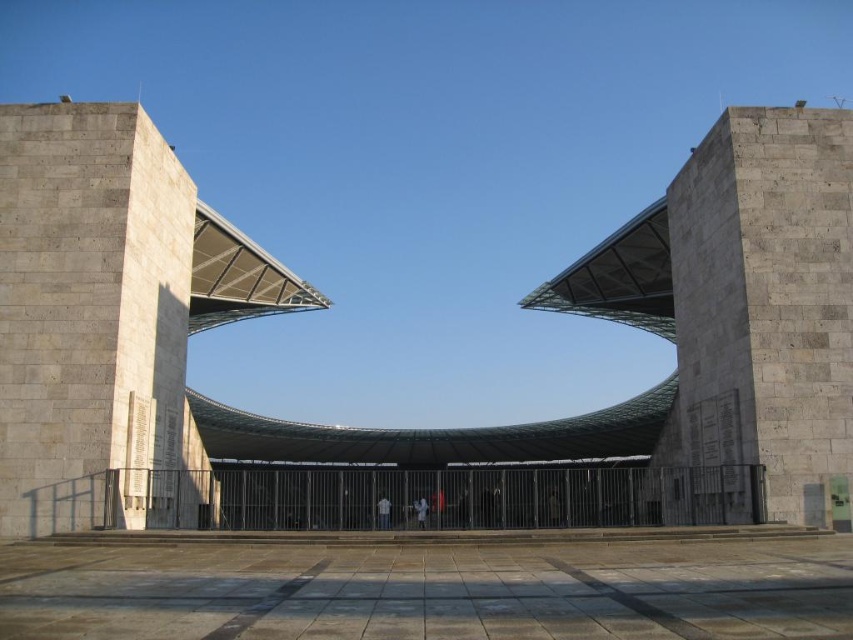
Question: Is gray stone arch at center wider than gray stone pillar at right?

Choices:
 (A) yes
 (B) no

Answer: (A)

Question: Which point appears closest to the camera in this image?

Choices:
 (A) (766, 212)
 (B) (30, 380)

Answer: (B)

Question: Does gray stone arch at center appear on the left side of gray stone pillar at right?

Choices:
 (A) yes
 (B) no

Answer: (A)

Question: Does gray stone arch at center appear on the left side of gray stone pillar at right?

Choices:
 (A) yes
 (B) no

Answer: (A)

Question: Which point is farther to the camera?

Choices:
 (A) (722, 209)
 (B) (131, 358)

Answer: (A)

Question: Which of the following is the closest to the observer?

Choices:
 (A) gray stone pillar at right
 (B) gray stone arch at center

Answer: (B)